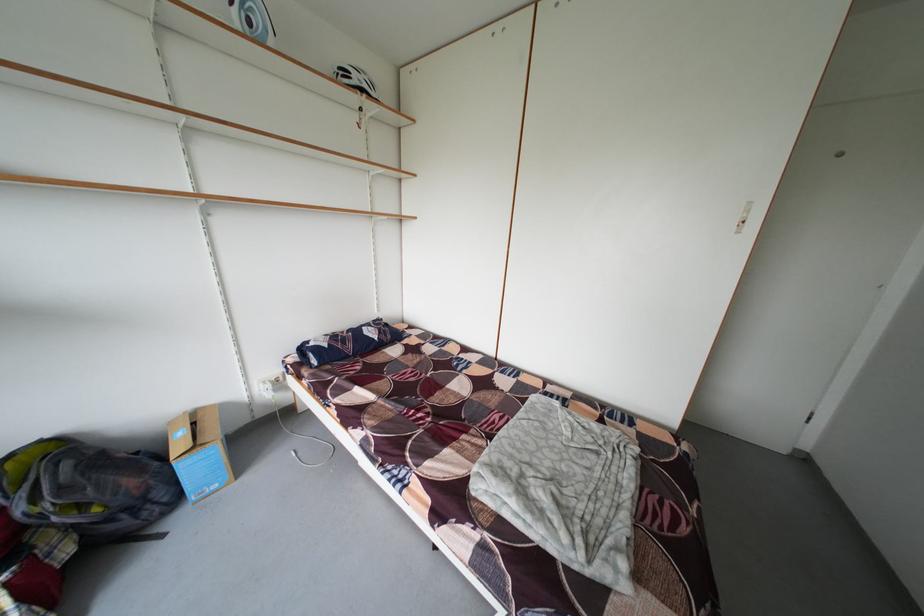
Find the location of `black backpack`. black backpack is located at coordinates (87, 488).